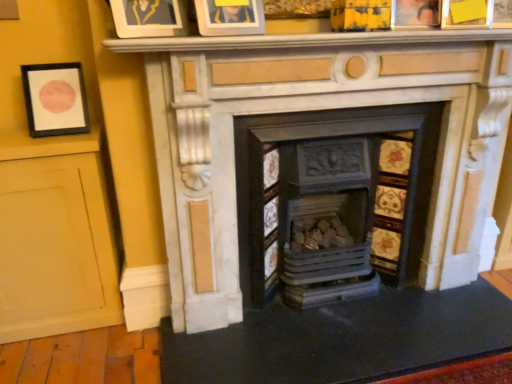
Question: Which direction should I rotate to look at white marble fireplace at center, arranged as the first fireplace when viewed from the right, — up or down?

Choices:
 (A) up
 (B) down

Answer: (A)

Question: Does wooden photo frame at upper right, the 3th picture frame positioned from the left, have a larger size compared to matte black picture frame at left, which is the 1th picture frame in left-to-right order?

Choices:
 (A) yes
 (B) no

Answer: (B)

Question: Can you confirm if wooden photo frame at upper right, which is counted as the second picture frame, starting from the right, is positioned to the left of matte black picture frame at left, which ranks as the 4th picture frame in right-to-left order?

Choices:
 (A) yes
 (B) no

Answer: (B)

Question: Is matte black picture frame at left, which is the 1th picture frame in left-to-right order, completely or partially inside wooden photo frame at upper right, which is counted as the second picture frame, starting from the right?

Choices:
 (A) yes
 (B) no

Answer: (B)

Question: Are wooden photo frame at upper right, the 3th picture frame positioned from the left, and matte black picture frame at left, which is the 1th picture frame in left-to-right order, located far from each other?

Choices:
 (A) yes
 (B) no

Answer: (A)

Question: Is wooden photo frame at upper right, which is counted as the second picture frame, starting from the right, outside matte black picture frame at left, which ranks as the 4th picture frame in right-to-left order?

Choices:
 (A) no
 (B) yes

Answer: (B)

Question: Does wooden photo frame at upper right, which is counted as the second picture frame, starting from the right, come in front of matte black picture frame at left, which ranks as the 4th picture frame in right-to-left order?

Choices:
 (A) yes
 (B) no

Answer: (A)

Question: Can you confirm if rustic wood logs at center, positioned as the first fireplace in left-to-right order, is bigger than matte black picture frame at left, which ranks as the 4th picture frame in right-to-left order?

Choices:
 (A) yes
 (B) no

Answer: (A)

Question: From a real-world perspective, is rustic wood logs at center, positioned as the first fireplace in left-to-right order, physically below matte black picture frame at left, which is the 1th picture frame in left-to-right order?

Choices:
 (A) no
 (B) yes

Answer: (B)

Question: From a real-world perspective, does rustic wood logs at center, positioned as the first fireplace in left-to-right order, stand above matte black picture frame at left, which is the 1th picture frame in left-to-right order?

Choices:
 (A) yes
 (B) no

Answer: (B)

Question: Is rustic wood logs at center, positioned as the first fireplace in left-to-right order, to the left of matte black picture frame at left, which ranks as the 4th picture frame in right-to-left order, from the viewer's perspective?

Choices:
 (A) no
 (B) yes

Answer: (A)

Question: Considering the relative sizes of rustic wood logs at center, positioned as the first fireplace in left-to-right order, and matte black picture frame at left, which ranks as the 4th picture frame in right-to-left order, in the image provided, is rustic wood logs at center, positioned as the first fireplace in left-to-right order, thinner than matte black picture frame at left, which ranks as the 4th picture frame in right-to-left order,?

Choices:
 (A) no
 (B) yes

Answer: (A)

Question: From the image's perspective, does rustic wood logs at center, which is the 2th fireplace from right to left, appear higher than matte black picture frame at left, which ranks as the 4th picture frame in right-to-left order?

Choices:
 (A) yes
 (B) no

Answer: (B)

Question: From the image's perspective, is white marble fireplace at center, which is the second fireplace in left-to-right order, above wooden photo frame at upper right, which is counted as the second picture frame, starting from the right?

Choices:
 (A) yes
 (B) no

Answer: (B)